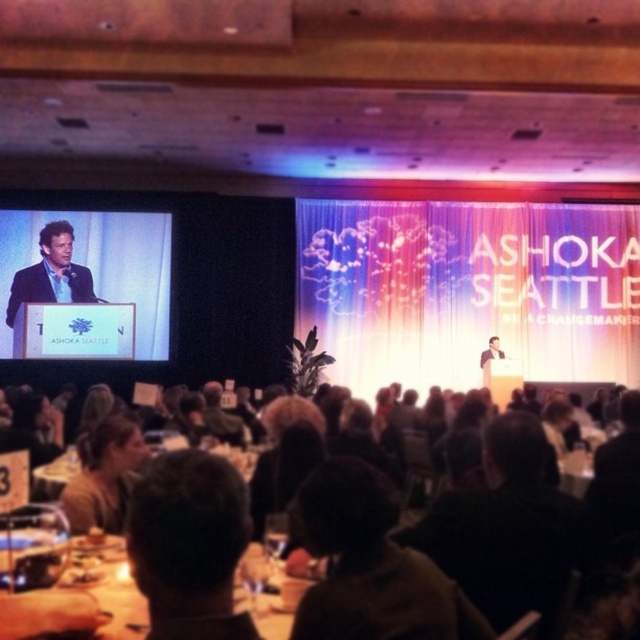
Does white fabric at center have a larger size compared to brown leather jacket at lower left?

Indeed, white fabric at center has a larger size compared to brown leather jacket at lower left.

Does white fabric at center appear on the left side of brown leather jacket at lower left?

Incorrect, white fabric at center is not on the left side of brown leather jacket at lower left.

This screenshot has height=640, width=640. What do you see at coordinates (468, 289) in the screenshot?
I see `white fabric at center` at bounding box center [468, 289].

Locate an element on the screen. The width and height of the screenshot is (640, 640). white fabric at center is located at coordinates (468, 289).

Can you confirm if dark brown hair at lower center is positioned below matte black suit at center?

Correct, dark brown hair at lower center is located below matte black suit at center.

What do you see at coordinates (609, 614) in the screenshot?
I see `dark brown hair at lower center` at bounding box center [609, 614].

The image size is (640, 640). What are the coordinates of `dark brown hair at lower center` in the screenshot? It's located at (609, 614).

How distant is dark brown hair at center from matte black screen at left?

They are 13.72 meters apart.

Does point (188, 621) lie behind point (19, 241)?

No, (188, 621) is closer to viewer.

Locate an element on the screen. dark brown hair at center is located at coordinates (188, 545).

At what (x,y) coordinates should I click in order to perform the action: click on dark brown hair at center. Please return your answer as a coordinate pair (x, y). The image size is (640, 640). Looking at the image, I should click on (188, 545).